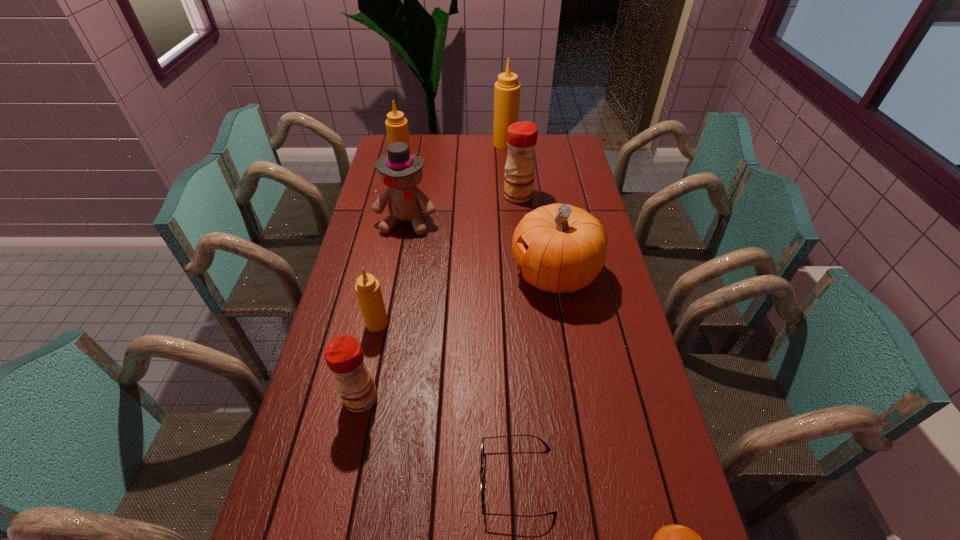
At what (x,y) coordinates should I click in order to perform the action: click on object that is the seventh closest to the bigger red condiment. Please return your answer as a coordinate pair (x, y). Looking at the image, I should click on (482, 445).

The image size is (960, 540). Find the location of `object that is the sixth closest one to the second nearest object`. object that is the sixth closest one to the second nearest object is located at coordinates (519, 176).

Point out which condiment is positioned as the fourth nearest to the eighth tallest object. Please provide its 2D coordinates. Your answer should be formatted as a tuple, i.e. [(x, y)], where the tuple contains the x and y coordinates of a point satisfying the conditions above.

[(397, 130)]

Where is `condiment that is the second closest to the third nearest condiment`? condiment that is the second closest to the third nearest condiment is located at coordinates (397, 130).

Locate which tan condiment ranks third in proximity to the seventh nearest object. Please provide its 2D coordinates. Your answer should be formatted as a tuple, i.e. [(x, y)], where the tuple contains the x and y coordinates of a point satisfying the conditions above.

[(367, 287)]

Identify which tan condiment is the third nearest to the fifth farthest object. Please provide its 2D coordinates. Your answer should be formatted as a tuple, i.e. [(x, y)], where the tuple contains the x and y coordinates of a point satisfying the conditions above.

[(507, 89)]

What are the coordinates of `vacant region that satisfies the following two spatial constraints: 1. on the back side of the right red condiment; 2. on the right side of the fourth nearest object` in the screenshot? It's located at (403, 195).

This screenshot has width=960, height=540. Identify the location of vacant space that satisfies the following two spatial constraints: 1. on the front side of the second farthest condiment; 2. on the left side of the bigger red condiment. (397, 195).

You are a GUI agent. You are given a task and a screenshot of the screen. Output one action in this format:
    pyautogui.click(x=<x>, y=<y>)
    Task: Click on the vacant point that satisfies the following two spatial constraints: 1. on the front side of the farthest tan condiment; 2. on the front-facing side of the spectacles
    The height and width of the screenshot is (540, 960).
    Given the screenshot: What is the action you would take?
    pyautogui.click(x=531, y=480)